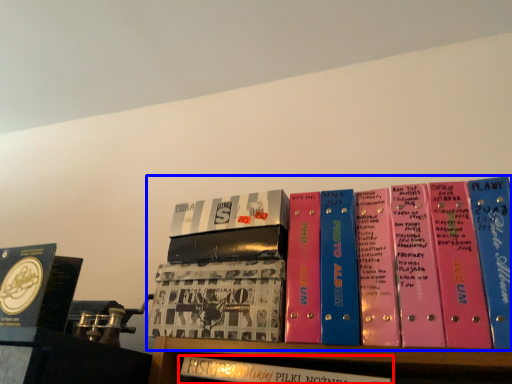
Question: Which object appears closest to the camera in this image, book (highlighted by a red box) or book (highlighted by a blue box)?

Choices:
 (A) book
 (B) book

Answer: (B)